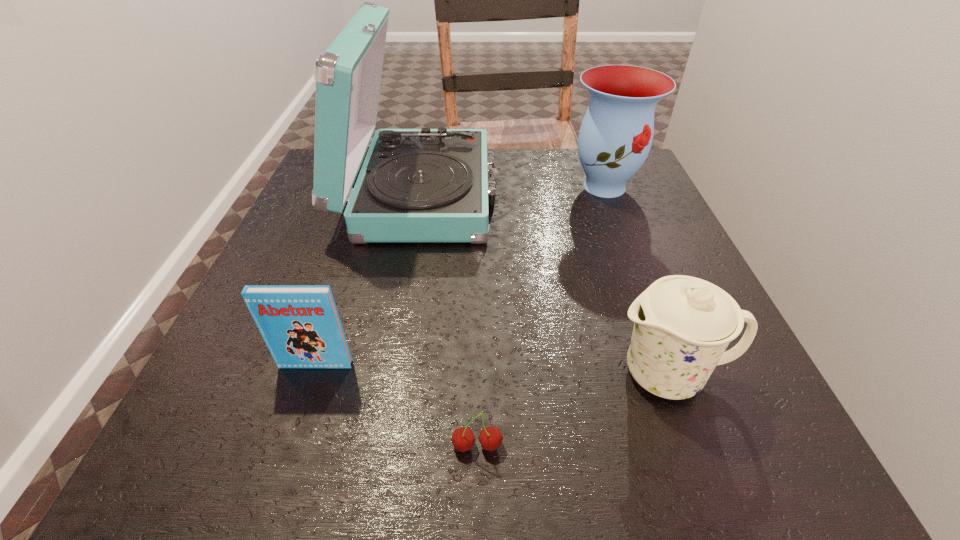
Locate an element on the screen. The width and height of the screenshot is (960, 540). free region located on the spout of the chinaware is located at coordinates (529, 374).

Where is `vacant area situated on the front cover of the book`? The image size is (960, 540). vacant area situated on the front cover of the book is located at coordinates (297, 423).

You are a GUI agent. You are given a task and a screenshot of the screen. Output one action in this format:
    pyautogui.click(x=<x>, y=<y>)
    Task: Click on the record player present at the far edge
    
    Given the screenshot: What is the action you would take?
    pyautogui.click(x=425, y=185)

This screenshot has width=960, height=540. I want to click on vase present at the far edge, so click(615, 137).

Find the location of a particular element. object present at the near edge is located at coordinates (490, 438).

The width and height of the screenshot is (960, 540). Find the location of `record player that is at the left edge`. record player that is at the left edge is located at coordinates (425, 185).

Where is `book that is at the left edge`? This screenshot has height=540, width=960. book that is at the left edge is located at coordinates (300, 324).

Locate an element on the screen. Image resolution: width=960 pixels, height=540 pixels. vase present at the right edge is located at coordinates (615, 137).

I want to click on chinaware located in the right edge section of the desktop, so click(683, 324).

Where is `object positioned at the far left corner`? Image resolution: width=960 pixels, height=540 pixels. object positioned at the far left corner is located at coordinates (425, 185).